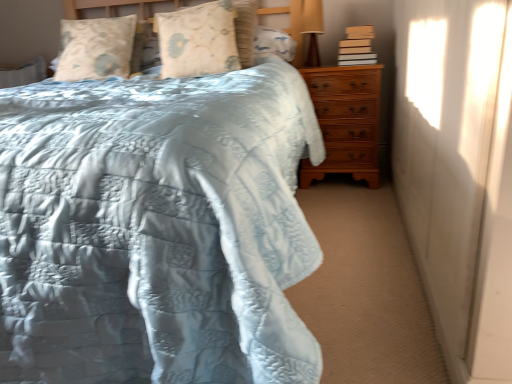
Question: In terms of height, does light blue quilted bed at center look taller or shorter compared to white matte curtain at right?

Choices:
 (A) tall
 (B) short

Answer: (A)

Question: From the image's perspective, is light blue quilted bed at center located above or below white matte curtain at right?

Choices:
 (A) below
 (B) above

Answer: (B)

Question: Which of these objects is positioned closest to the light brown cardboard book at upper right?

Choices:
 (A) floral-patterned fabric pillow at upper center, positioned as the first pillow in right-to-left order
 (B) light blue quilted bed at center
 (C) matte brown table lamp at upper right
 (D) white matte curtain at right
 (E) light beige fabric pillow at upper left, which is counted as the second pillow, starting from the right

Answer: (C)

Question: Based on their relative distances, which object is nearer to the white matte curtain at right?

Choices:
 (A) light beige fabric pillow at upper left, which is counted as the second pillow, starting from the right
 (B) matte brown table lamp at upper right
 (C) light blue quilted bed at center
 (D) floral-patterned fabric pillow at upper center, the 2th pillow positioned from the left
 (E) brown wooden chest of drawers at right

Answer: (C)